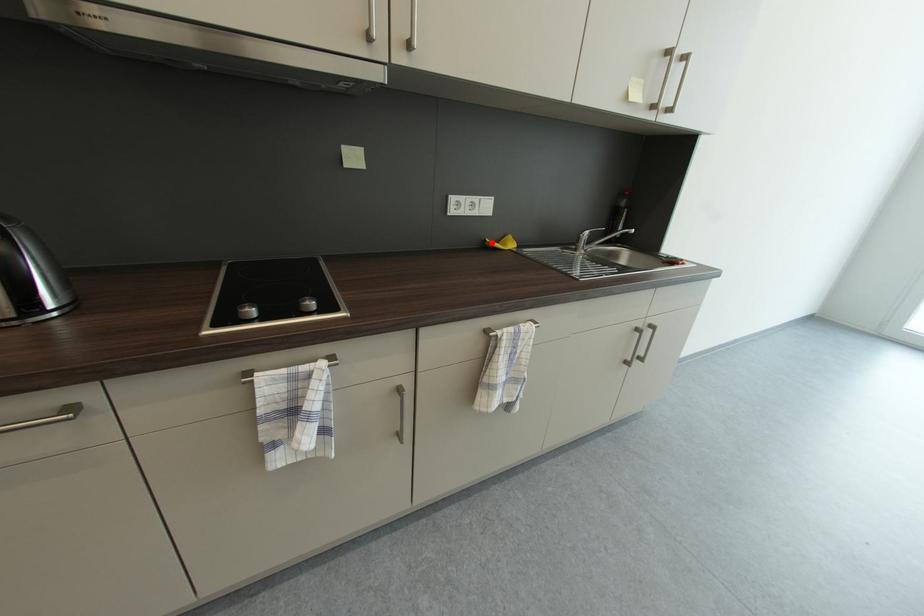
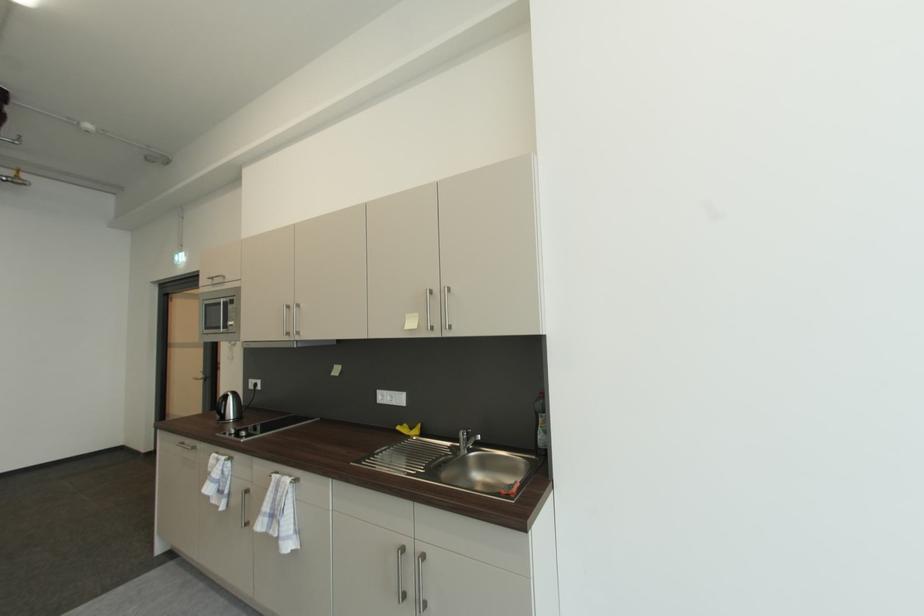
The point at the highlighted location is marked in the first image. Where is the corresponding point in the second image?

(408, 427)